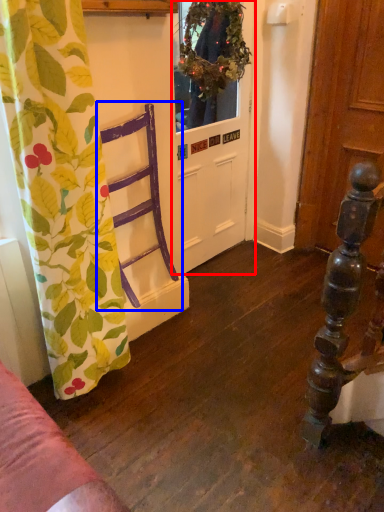
Question: Among these objects, which one is nearest to the camera, door (highlighted by a red box) or armchair (highlighted by a blue box)?

Choices:
 (A) door
 (B) armchair

Answer: (B)